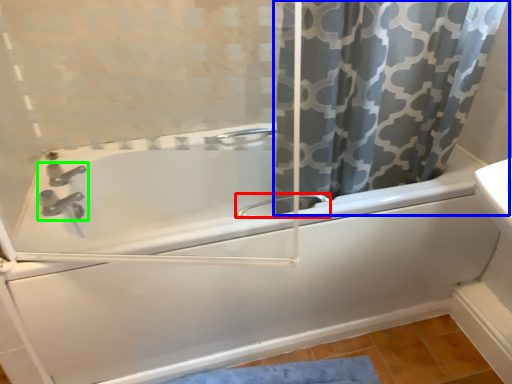
Question: Considering the real-world distances, which object is farthest from faucet (highlighted by a red box)? curtain (highlighted by a blue box) or tap (highlighted by a green box)?

Choices:
 (A) curtain
 (B) tap

Answer: (B)